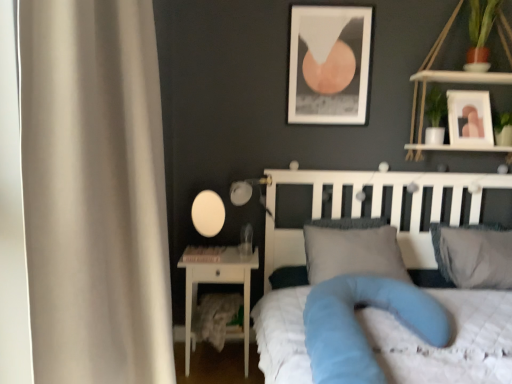
Question: Does white matte picture frame at upper right, the first picture frame from the right, have a lesser height compared to matte white picture frame at upper center, which is counted as the 2th picture frame, starting from the right?

Choices:
 (A) no
 (B) yes

Answer: (B)

Question: Is white matte picture frame at upper right, the 2th picture frame from the left, oriented towards matte white picture frame at upper center, which is counted as the 2th picture frame, starting from the right?

Choices:
 (A) no
 (B) yes

Answer: (A)

Question: Does white matte picture frame at upper right, the 2th picture frame from the left, appear on the left side of matte white picture frame at upper center, which is counted as the 2th picture frame, starting from the right?

Choices:
 (A) no
 (B) yes

Answer: (A)

Question: Considering the relative sizes of white matte picture frame at upper right, the first picture frame from the right, and matte white picture frame at upper center, which is counted as the 2th picture frame, starting from the right, in the image provided, is white matte picture frame at upper right, the first picture frame from the right, bigger than matte white picture frame at upper center, which is counted as the 2th picture frame, starting from the right,?

Choices:
 (A) no
 (B) yes

Answer: (B)

Question: Is white matte picture frame at upper right, the first picture frame from the right, positioned beyond the bounds of matte white picture frame at upper center, the 1th picture frame from the left?

Choices:
 (A) no
 (B) yes

Answer: (B)

Question: Is white matte picture frame at upper right, the first picture frame from the right, positioned behind matte white picture frame at upper center, the 1th picture frame from the left?

Choices:
 (A) no
 (B) yes

Answer: (A)

Question: Is white glossy nightstand at lower left further to the viewer compared to white matte picture frame at upper right, the first picture frame from the right?

Choices:
 (A) no
 (B) yes

Answer: (A)

Question: Is white matte picture frame at upper right, the 2th picture frame from the left, located within white glossy nightstand at lower left?

Choices:
 (A) no
 (B) yes

Answer: (A)

Question: Considering the relative sizes of white glossy nightstand at lower left and white matte picture frame at upper right, the first picture frame from the right, in the image provided, is white glossy nightstand at lower left taller than white matte picture frame at upper right, the first picture frame from the right,?

Choices:
 (A) no
 (B) yes

Answer: (B)

Question: From the image's perspective, is white glossy nightstand at lower left on top of white matte picture frame at upper right, the first picture frame from the right?

Choices:
 (A) no
 (B) yes

Answer: (A)

Question: Is white glossy nightstand at lower left facing away from white matte picture frame at upper right, the 2th picture frame from the left?

Choices:
 (A) yes
 (B) no

Answer: (B)

Question: Is white glossy nightstand at lower left positioned in front of white matte picture frame at upper right, the first picture frame from the right?

Choices:
 (A) yes
 (B) no

Answer: (A)

Question: Is matte white picture frame at upper center, which is counted as the 2th picture frame, starting from the right, touching white glossy nightstand at lower left?

Choices:
 (A) no
 (B) yes

Answer: (A)